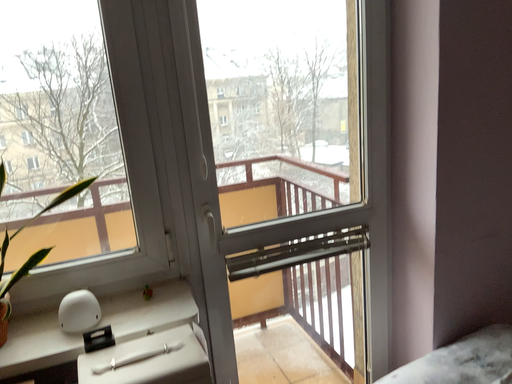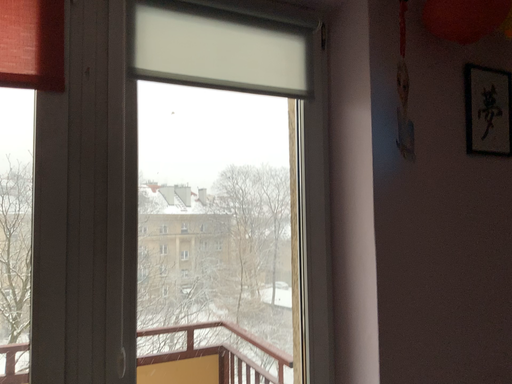
Question: How did the camera likely rotate when shooting the video?

Choices:
 (A) rotated downward
 (B) rotated upward

Answer: (B)